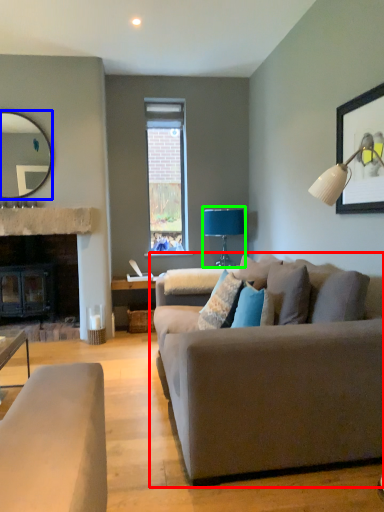
Question: Which object is positioned farthest from studio couch (highlighted by a red box)? Select from mirror (highlighted by a blue box) and table lamp (highlighted by a green box).

Choices:
 (A) mirror
 (B) table lamp

Answer: (A)